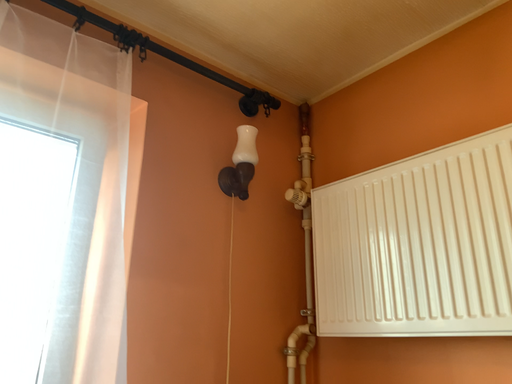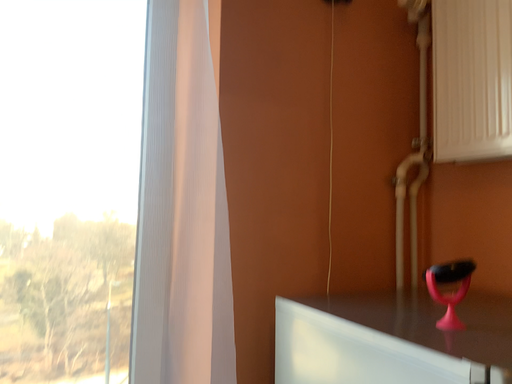
Question: Which way did the camera rotate in the video?

Choices:
 (A) rotated downward
 (B) rotated upward

Answer: (A)